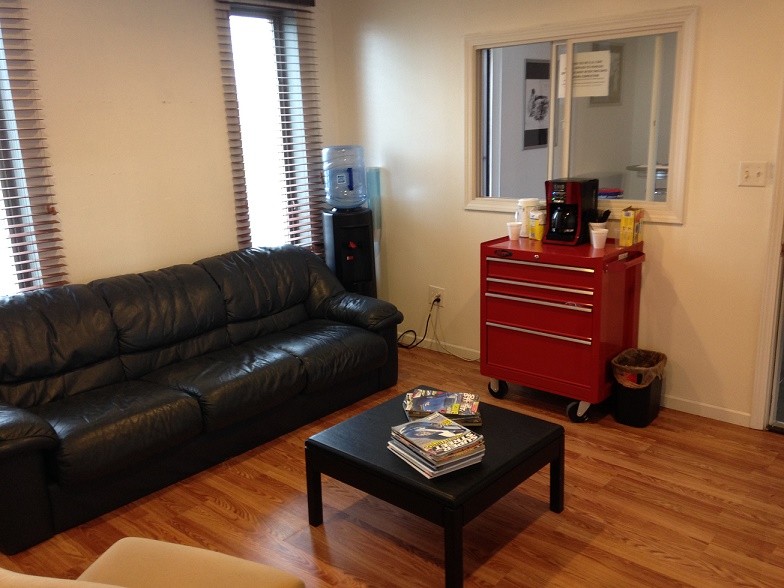
At what (x,y) coordinates should I click in order to perform the action: click on water cooler. Please return your answer as a coordinate pair (x, y). Looking at the image, I should click on (340, 180).